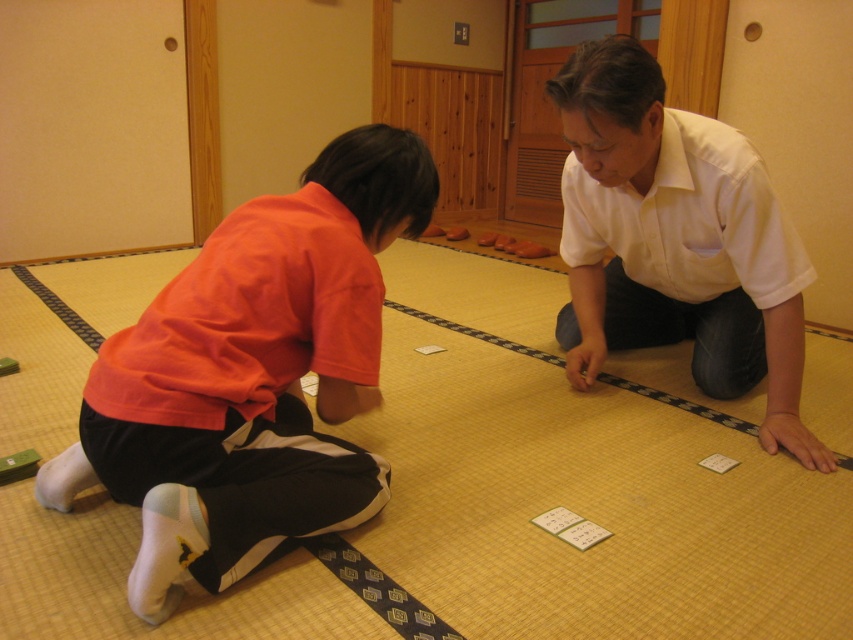
Which is more to the right, white matte shirt at center or white paper cards at center?

white matte shirt at center

Does point (567, 340) come closer to viewer compared to point (596, 534)?

No, it is behind (596, 534).

In order to click on white matte shirt at center in this screenshot , I will do `click(675, 241)`.

I want to click on white matte shirt at center, so click(675, 241).

Between orange cotton shirt at lower left and white matte shirt at center, which one is positioned lower?

Positioned lower is orange cotton shirt at lower left.

Which is in front, point (258, 224) or point (766, 328)?

Point (258, 224) is in front.

The width and height of the screenshot is (853, 640). Find the location of `orange cotton shirt at lower left`. orange cotton shirt at lower left is located at coordinates (252, 376).

Between orange cotton shirt at lower left and white paper cards at center, which one appears on the left side from the viewer's perspective?

orange cotton shirt at lower left

Does point (204, 362) come closer to viewer compared to point (569, 522)?

Yes.

This screenshot has width=853, height=640. I want to click on orange cotton shirt at lower left, so click(252, 376).